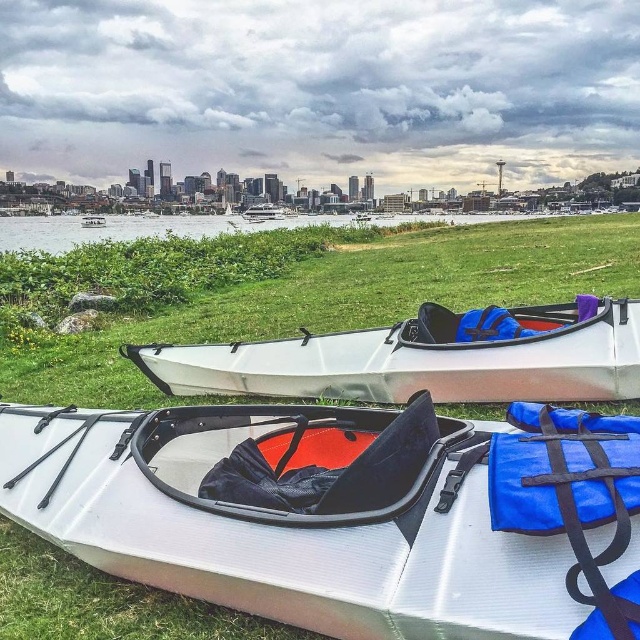
Question: Based on their relative distances, which object is nearer to the white glossy kayak at center?

Choices:
 (A) white water at center
 (B) white glossy boat at center

Answer: (A)

Question: Estimate the real-world distances between objects in this image. Which object is farther from the white glossy boat at center?

Choices:
 (A) white water at center
 (B) white plastic kayak at center
 (C) white matte kayak at lower center
 (D) white glossy kayak at center

Answer: (B)

Question: Can you confirm if white plastic kayak at center is positioned to the left of white glossy kayak at center?

Choices:
 (A) no
 (B) yes

Answer: (B)

Question: Can you confirm if white plastic kayak at center is thinner than white glossy kayak at center?

Choices:
 (A) yes
 (B) no

Answer: (A)

Question: Is white plastic kayak at center bigger than white glossy kayak at center?

Choices:
 (A) yes
 (B) no

Answer: (B)

Question: Based on their relative distances, which object is nearer to the white glossy kayak at center?

Choices:
 (A) white water at center
 (B) white plastic kayak at center
 (C) white matte kayak at lower center

Answer: (B)